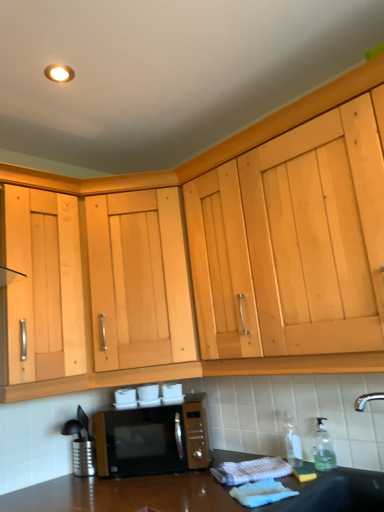
Question: Is transparent plastic soap dispenser at lower right, acting as the 2th bottle starting from the left, spatially inside clear glass bottle at lower right, the 1th bottle positioned from the left, or outside of it?

Choices:
 (A) outside
 (B) inside

Answer: (A)

Question: Does point click(x=324, y=417) appear closer or farther from the camera than point click(x=291, y=431)?

Choices:
 (A) closer
 (B) farther

Answer: (A)

Question: Based on their relative distances, which object is nearer to the transparent plastic soap dispenser at lower right, the first bottle when ordered from right to left?

Choices:
 (A) matte black microwave at lower center
 (B) clear glass bottle at lower right, the 1th bottle positioned from the left
 (C) black matte sink at lower right
 (D) light wood cabinet at center

Answer: (B)

Question: Which is nearer to the transparent plastic soap dispenser at lower right, acting as the 2th bottle starting from the left?

Choices:
 (A) black matte sink at lower right
 (B) light wood cabinet at center
 (C) matte black microwave at lower center
 (D) clear glass bottle at lower right, the second bottle viewed from the right

Answer: (D)